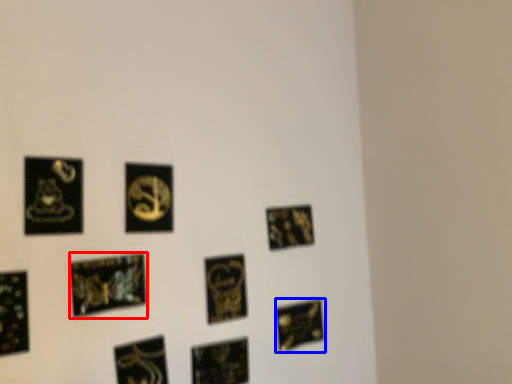
Question: Which object appears closest to the camera in this image, picture frame (highlighted by a red box) or picture frame (highlighted by a blue box)?

Choices:
 (A) picture frame
 (B) picture frame

Answer: (A)